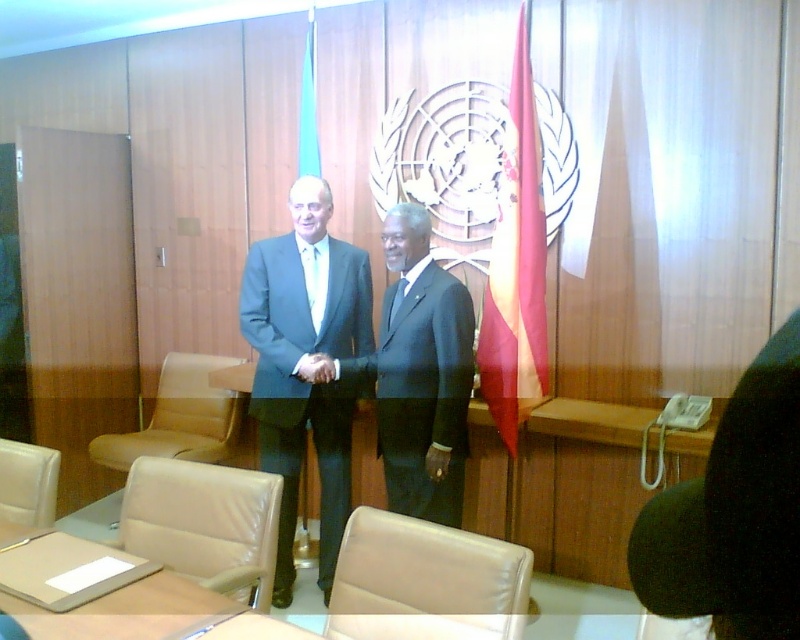
Describe the element at coordinates (204, 524) in the screenshot. I see `beige leather chair at lower left` at that location.

What are the coordinates of `beige leather chair at lower left` in the screenshot? It's located at (204, 524).

Who is shorter, leather at left or blue fabric flag at center?

leather at left

Between leather at left and blue fabric flag at center, which one appears on the right side from the viewer's perspective?

blue fabric flag at center

Describe the element at coordinates (180, 417) in the screenshot. The image size is (800, 640). I see `leather at left` at that location.

I want to click on leather at left, so click(180, 417).

Which of these two, beige leather chair at lower center or leather at left, stands shorter?

Standing shorter between the two is beige leather chair at lower center.

Find the location of a particular element. The width and height of the screenshot is (800, 640). beige leather chair at lower center is located at coordinates (425, 580).